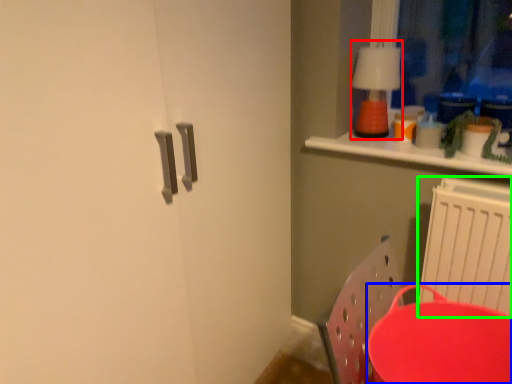
Question: Which object is the closest to the lamp (highlighted by a red box)? Choose among these: round table (highlighted by a blue box) or radiator (highlighted by a green box).

Choices:
 (A) round table
 (B) radiator

Answer: (B)